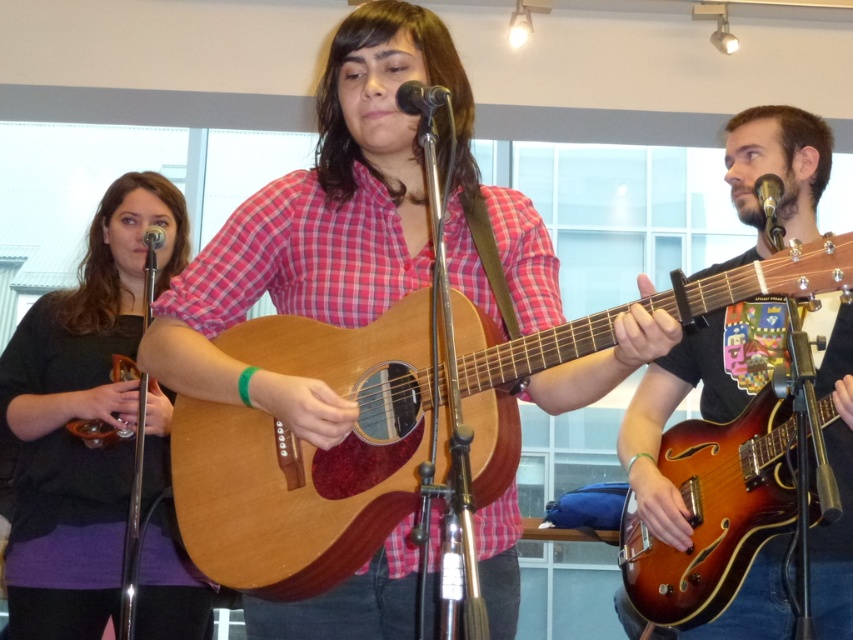
Between wooden acoustic guitar at center and black matte microphone at center, which one has more height?

Standing taller between the two is wooden acoustic guitar at center.

Does wooden acoustic guitar at center appear under black matte microphone at center?

Indeed, wooden acoustic guitar at center is positioned under black matte microphone at center.

The height and width of the screenshot is (640, 853). What do you see at coordinates (305, 456) in the screenshot?
I see `wooden acoustic guitar at center` at bounding box center [305, 456].

Find the location of a particular element. The width and height of the screenshot is (853, 640). wooden acoustic guitar at center is located at coordinates (305, 456).

Is wooden acoustic guitar at center positioned behind shiny brown guitar at right?

No, wooden acoustic guitar at center is closer to the viewer.

Does wooden acoustic guitar at center appear over shiny brown guitar at right?

Yes.

Which is in front, point (364, 380) or point (816, 545)?

Point (364, 380) is in front.

Locate an element on the screen. The width and height of the screenshot is (853, 640). wooden acoustic guitar at center is located at coordinates (305, 456).

Is matte wood guitar at center thinner than matte black sweater at left?

Incorrect, matte wood guitar at center's width is not less than matte black sweater at left's.

Can you confirm if matte wood guitar at center is bigger than matte black sweater at left?

Indeed, matte wood guitar at center has a larger size compared to matte black sweater at left.

Is point (424, 252) behind point (12, 365)?

No, it is in front of (12, 365).

Image resolution: width=853 pixels, height=640 pixels. Identify the location of matte wood guitar at center. (349, 228).